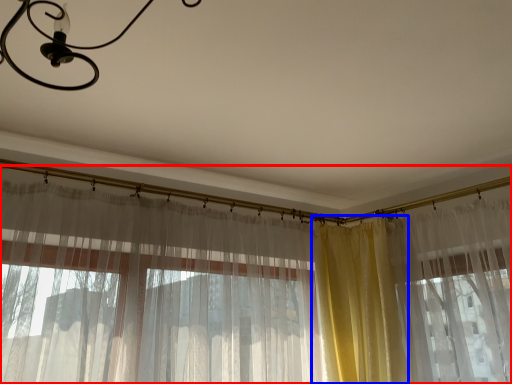
Question: Which object is closer to the camera taking this photo, curtain (highlighted by a red box) or curtain (highlighted by a blue box)?

Choices:
 (A) curtain
 (B) curtain

Answer: (A)